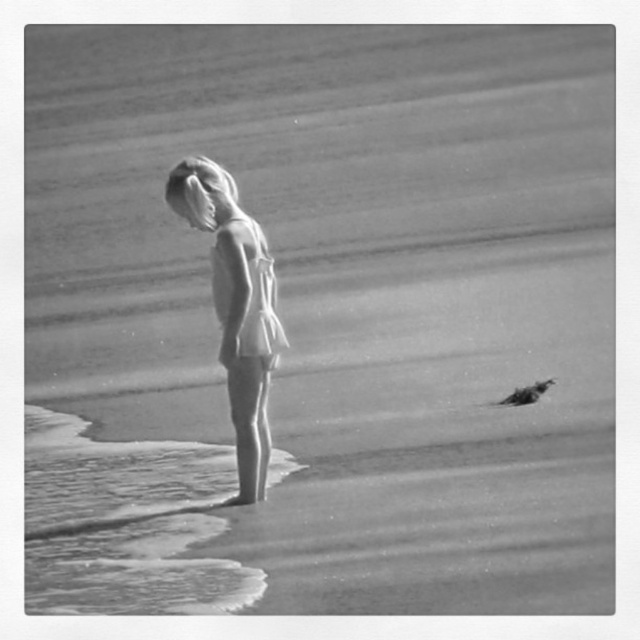
You are standing at the center of the beach scene in the image. You want to find the clear water at lower left. Based on the coordinates provided, in which direction should you move to reach it?

The clear water at lower left is located at coordinates point (124, 524). Since you are at the center, you should move towards the lower left direction to reach it.

You are a photographer trying to capture the scene. You need to position your camera so that the smooth white dress at center and the smooth feathered bird at lower right are both in the frame. Based on their positions, which object should you focus on first to ensure both are in focus?

The smooth white dress at center is located above the smooth feathered bird at lower right, so you should focus on the smooth white dress at center first to ensure both are in focus since it is closer to the camera.

You are a photographer analyzing this beach scene. You need to place a marker at the exact 2D coordinates where the clear water at lower left is located. What are the coordinates?

Answer: The clear water at lower left is located at coordinates (124, 524).